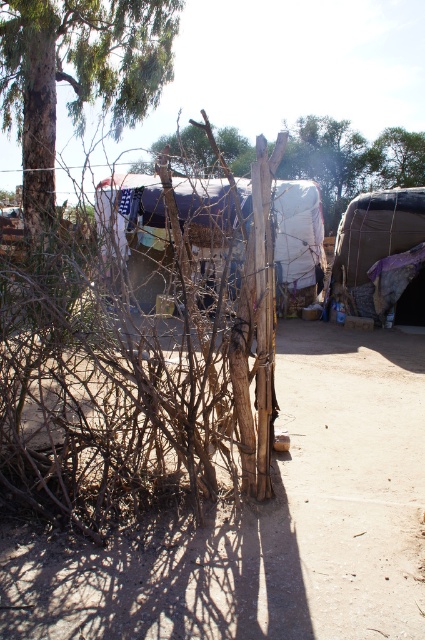
Is point (127, 611) closer to camera compared to point (8, 129)?

Yes, point (127, 611) is closer to viewer.

Can you confirm if dirt field at center is positioned to the left of green rough bark tree at upper left?

No, dirt field at center is not to the left of green rough bark tree at upper left.

Describe the element at coordinates (266, 522) in the screenshot. The image size is (425, 640). I see `dirt field at center` at that location.

Find the location of `dirt field at center`. dirt field at center is located at coordinates (266, 522).

Based on the photo, can you confirm if dirt field at center is positioned below white fabric tent at center?

Yes, dirt field at center is below white fabric tent at center.

Where is `dirt field at center`? dirt field at center is located at coordinates (266, 522).

Is point (164, 520) positioned behind point (212, 193)?

No, it is not.

Identify the location of dirt field at center. The width and height of the screenshot is (425, 640). (266, 522).

Who is more distant from viewer, (303, 241) or (380, 252)?

Point (303, 241)

Is the position of white fabric tent at center less distant than that of textured brown fabric tent at center?

Yes.

Which is behind, point (297, 280) or point (363, 253)?

The point (297, 280) is behind.

The height and width of the screenshot is (640, 425). In order to click on white fabric tent at center in this screenshot , I will do `click(297, 237)`.